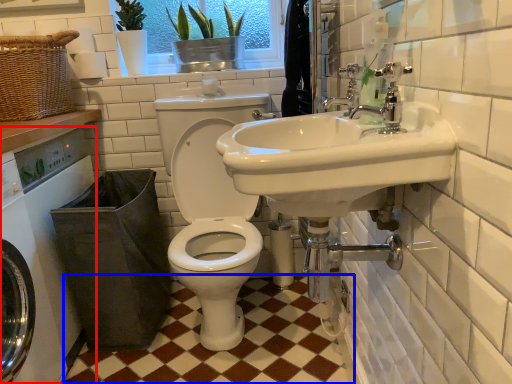
Question: Which point is further to the camera, washing machine (highlighted by a red box) or ceramic tile (highlighted by a blue box)?

Choices:
 (A) washing machine
 (B) ceramic tile

Answer: (B)